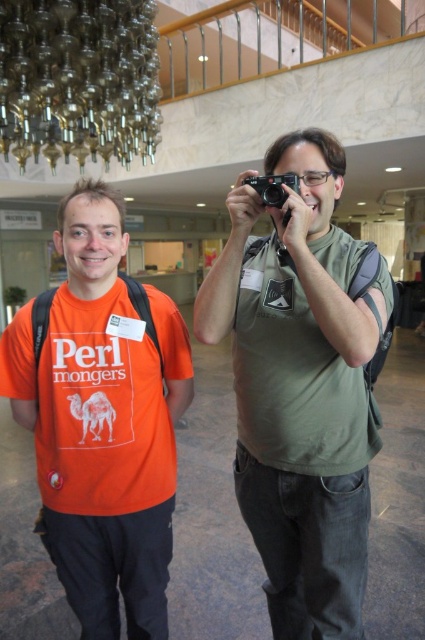
This screenshot has height=640, width=425. What do you see at coordinates (302, 387) in the screenshot? I see `green matte shirt at center` at bounding box center [302, 387].

From the picture: Is green matte shirt at center smaller than black plastic camera at center?

No, green matte shirt at center is not smaller than black plastic camera at center.

Locate an element on the screen. Image resolution: width=425 pixels, height=640 pixels. green matte shirt at center is located at coordinates [302, 387].

Locate an element on the screen. This screenshot has height=640, width=425. green matte shirt at center is located at coordinates (302, 387).

Is orange cotton t-shirt at left behind black plastic camera at center?

Yes, orange cotton t-shirt at left is behind black plastic camera at center.

Does orange cotton t-shirt at left have a lesser height compared to black plastic camera at center?

No.

What do you see at coordinates (102, 422) in the screenshot? The width and height of the screenshot is (425, 640). I see `orange cotton t-shirt at left` at bounding box center [102, 422].

The width and height of the screenshot is (425, 640). I want to click on orange cotton t-shirt at left, so click(102, 422).

Does point (329, 481) come behind point (82, 611)?

No, (329, 481) is in front of (82, 611).

In order to click on green matte shirt at center in this screenshot , I will do pyautogui.click(x=302, y=387).